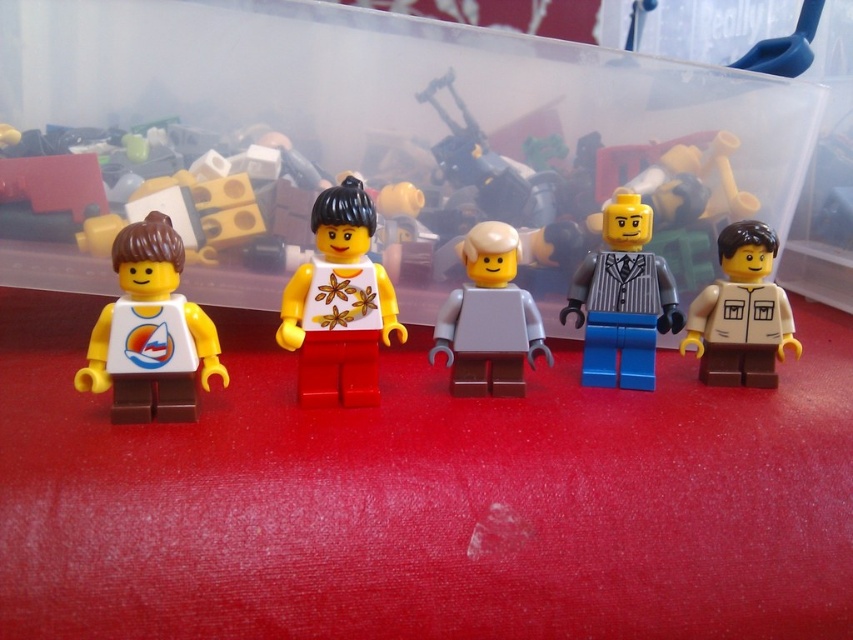
Is matte white shirt at center thinner than tan matte shirt at right?

Correct, matte white shirt at center's width is less than tan matte shirt at right's.

Who is positioned more to the left, matte white shirt at center or tan matte shirt at right?

Positioned to the left is matte white shirt at center.

Who is more distant from viewer, (352, 372) or (732, 376)?

Point (732, 376)

At what (x,y) coordinates should I click in order to perform the action: click on matte white shirt at center. Please return your answer as a coordinate pair (x, y). Image resolution: width=853 pixels, height=640 pixels. Looking at the image, I should click on (339, 304).

Does matte gray striped shirt at center have a lesser height compared to light gray matte minifigure at center?

Incorrect, matte gray striped shirt at center's height does not fall short of light gray matte minifigure at center's.

Does point (624, 195) come behind point (491, 224)?

Yes, it is behind point (491, 224).

Which is behind, point (676, 308) or point (471, 241)?

Positioned behind is point (676, 308).

What are the coordinates of `matte gray striped shirt at center` in the screenshot? It's located at (622, 300).

Between matte white shirt at center and matte white shirt at left, which one has more height?

matte white shirt at center is taller.

Which is below, matte white shirt at center or matte white shirt at left?

matte white shirt at left is lower down.

You are a GUI agent. You are given a task and a screenshot of the screen. Output one action in this format:
    pyautogui.click(x=<x>, y=<y>)
    Task: Click on the matte white shirt at center
    The width and height of the screenshot is (853, 640).
    Given the screenshot: What is the action you would take?
    pyautogui.click(x=339, y=304)

Where is `matte white shirt at center`? matte white shirt at center is located at coordinates (339, 304).